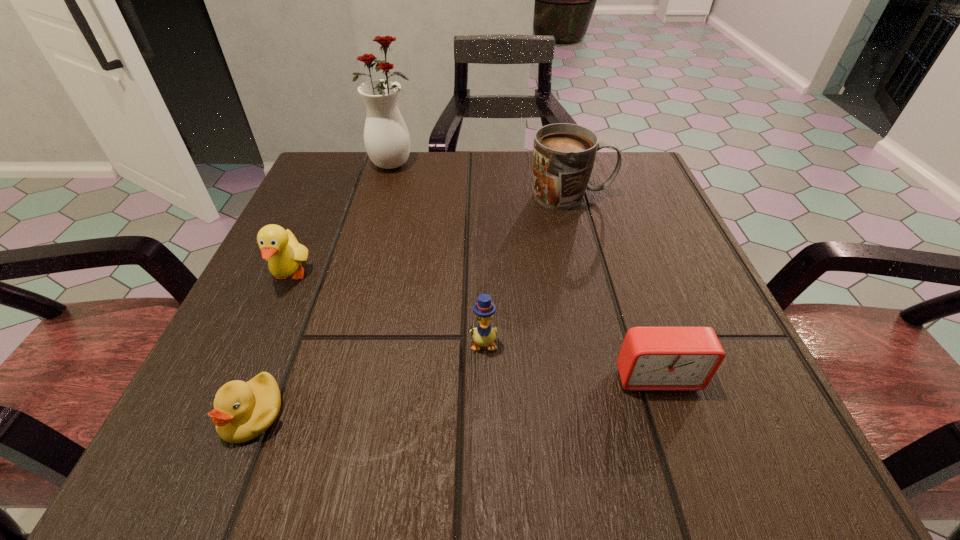
Find the location of `vacant space positioned 0.350m on the front of the tallest object`. vacant space positioned 0.350m on the front of the tallest object is located at coordinates (357, 289).

Image resolution: width=960 pixels, height=540 pixels. I want to click on vacant position located on the side of the fifth shortest object with the handle, so click(656, 196).

You are a GUI agent. You are given a task and a screenshot of the screen. Output one action in this format:
    pyautogui.click(x=<x>, y=<y>)
    Task: Click on the blank area located on the front-facing side of the third farthest object
    
    Given the screenshot: What is the action you would take?
    pyautogui.click(x=271, y=320)

Identify the location of free location located 0.050m on the face of the rightmost duckling, where the monocle is placed. This screenshot has height=540, width=960. (483, 385).

Locate an element on the screen. Image resolution: width=960 pixels, height=540 pixels. free spot located 0.070m on the front-facing side of the alarm clock is located at coordinates (681, 445).

Image resolution: width=960 pixels, height=540 pixels. I want to click on vase at the far edge, so click(386, 137).

Where is `mug that is at the far edge`? This screenshot has width=960, height=540. mug that is at the far edge is located at coordinates (564, 154).

The width and height of the screenshot is (960, 540). What are the coordinates of `object that is at the near edge` in the screenshot? It's located at (242, 411).

The image size is (960, 540). I want to click on vase situated at the left edge, so click(x=386, y=137).

I want to click on mug present at the right edge, so click(x=564, y=154).